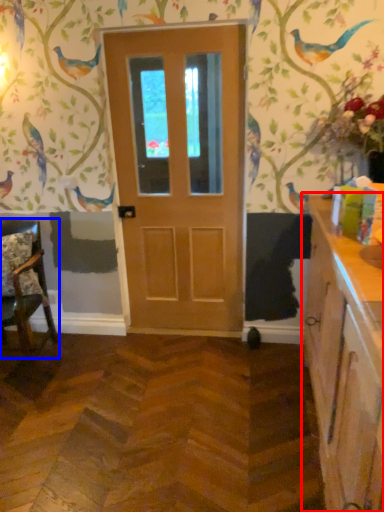
Question: Which object is closer to the camera taking this photo, cabinetry (highlighted by a red box) or chair (highlighted by a blue box)?

Choices:
 (A) cabinetry
 (B) chair

Answer: (A)